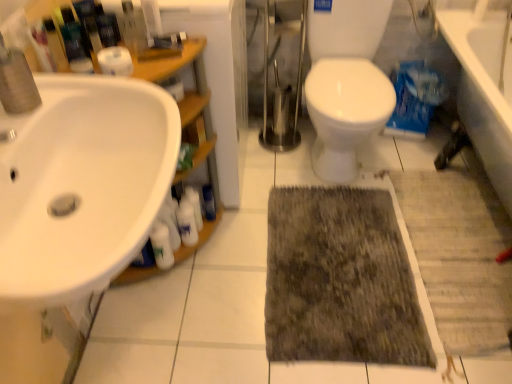
Where is `free space between white glossy bottle at center, positioned as the 2th toiletry in left-to-right order, and dark gray shaggy rug at center`? The width and height of the screenshot is (512, 384). free space between white glossy bottle at center, positioned as the 2th toiletry in left-to-right order, and dark gray shaggy rug at center is located at coordinates (246, 251).